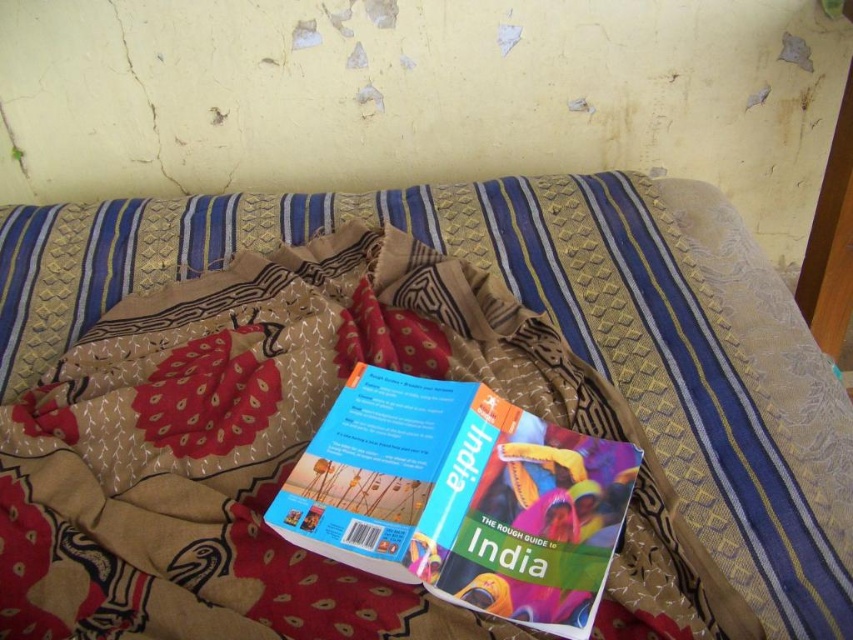
Question: Can you confirm if textured fabric bed at center is smaller than hardcover book at center?

Choices:
 (A) no
 (B) yes

Answer: (A)

Question: Can you confirm if textured fabric bed at center is positioned below hardcover book at center?

Choices:
 (A) yes
 (B) no

Answer: (B)

Question: Which point is farther to the camera?

Choices:
 (A) (590, 464)
 (B) (190, 294)

Answer: (B)

Question: Is textured fabric bed at center positioned before hardcover book at center?

Choices:
 (A) no
 (B) yes

Answer: (A)